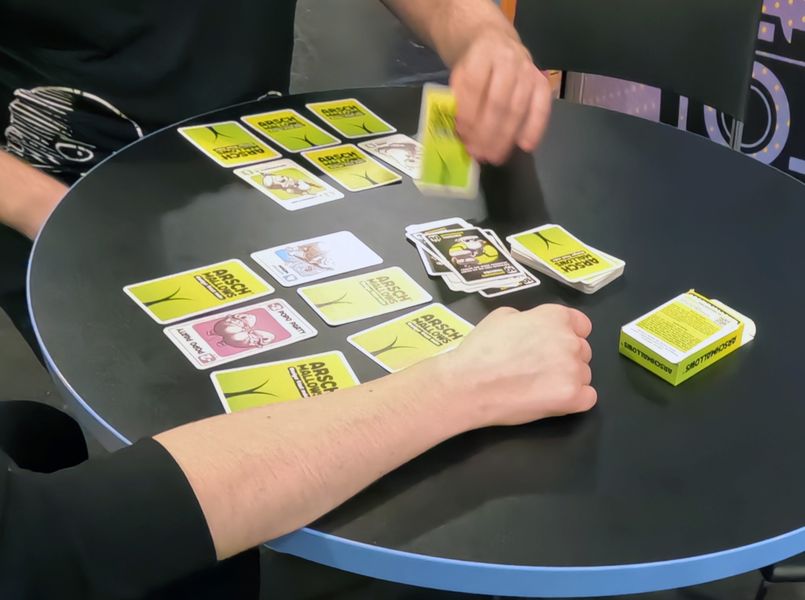
The width and height of the screenshot is (805, 600). I want to click on circular black table, so click(x=703, y=243).